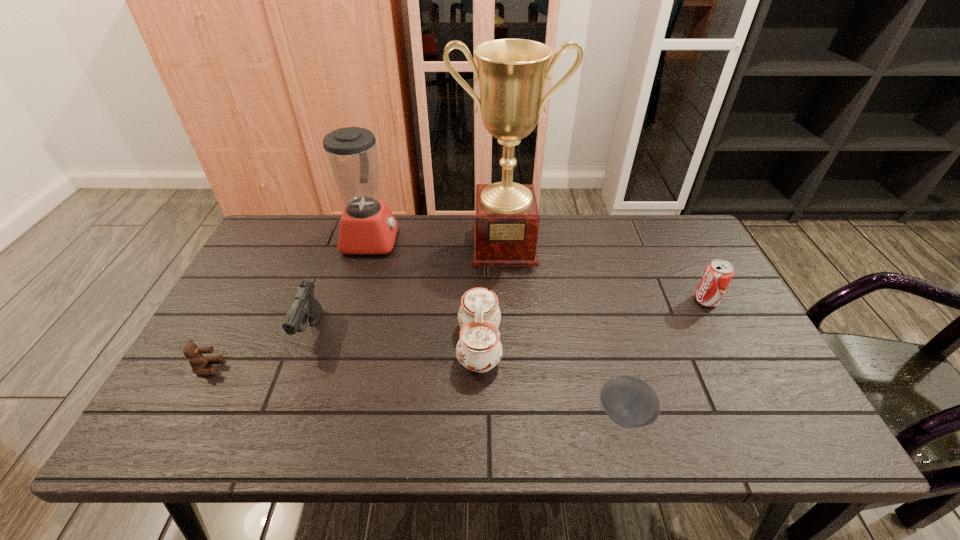
The image size is (960, 540). Find the location of `trophy cup`. trophy cup is located at coordinates (512, 72).

Where is `the second tallest object`? The height and width of the screenshot is (540, 960). the second tallest object is located at coordinates (367, 226).

Image resolution: width=960 pixels, height=540 pixels. Find the location of `the third tallest object`. the third tallest object is located at coordinates (479, 349).

Locate an element on the screen. This screenshot has height=540, width=960. soda can is located at coordinates (718, 273).

What are the coordinates of `pistol` in the screenshot? It's located at (305, 309).

Find the location of a particular element. the second shortest object is located at coordinates (197, 361).

Where is `teddy bear`? This screenshot has height=540, width=960. teddy bear is located at coordinates (197, 361).

In order to click on the nearest object in this screenshot , I will do `click(630, 402)`.

You are a GUI agent. You are given a task and a screenshot of the screen. Output one action in this format:
    pyautogui.click(x=<x>, y=<y>)
    Task: Click on the bowl
    The width and height of the screenshot is (960, 540).
    Given the screenshot: What is the action you would take?
    pyautogui.click(x=630, y=402)

Where is `free point located 0.060m on the plaque of the tallest object`? The image size is (960, 540). free point located 0.060m on the plaque of the tallest object is located at coordinates (507, 280).